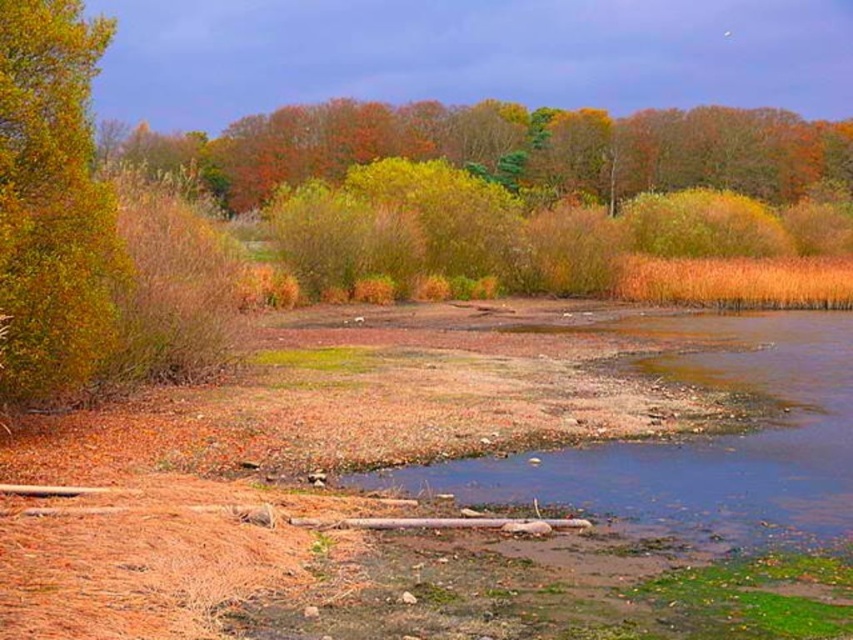
You are an artist setting up your easel to paint the autumn landscape. You want to capture the autumn leaves at upper center and the golden textured bush at left in your painting. Which object should you paint first if you are following the rule of painting from the back to the front?

You should paint the golden textured bush at left first because it is located below the autumn leaves at upper center, meaning it is closer to the front and should be painted after the background elements. Wait, actually, if the autumn leaves are above the bush, then the leaves are in the upper part, so the bush is lower, so the leaves are in the background. So painting from back to front, you would paint the autumn leaves first as they are in the back, then the bush in front.

You are an artist sketching the landscape and want to place the autumn leaves at upper center and the golden textured bush at left in your drawing. Which object should you draw first to maintain the correct spatial relationship?

You should draw the golden textured bush at left first because the autumn leaves at upper center is positioned on its right side, meaning the bush is to the left of the leaves and should be placed before drawing the leaves to ensure proper placement.